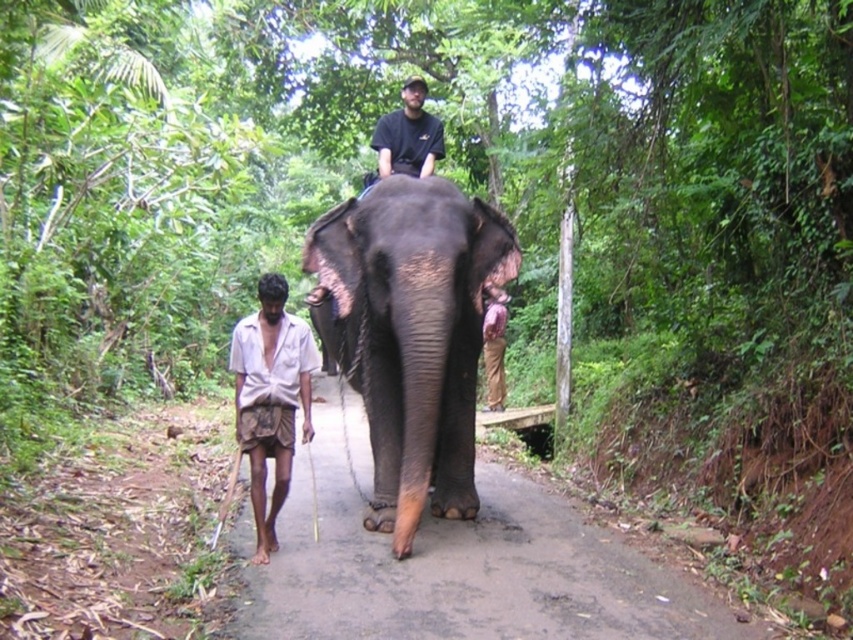
Question: Is dark gray textured elephant at center positioned at the back of white clothed man at left?

Choices:
 (A) yes
 (B) no

Answer: (A)

Question: Which object is farther from the camera taking this photo?

Choices:
 (A) white clothed man at left
 (B) dark gray textured elephant at center
 (C) black matte shirt at center
 (D) brown dirt path at center

Answer: (C)

Question: Which point appears closest to the camera in this image?

Choices:
 (A) (247, 637)
 (B) (396, 193)
 (C) (421, 106)

Answer: (A)

Question: Is brown dirt path at center positioned in front of black matte shirt at center?

Choices:
 (A) no
 (B) yes

Answer: (B)

Question: Which is nearer to the white clothed man at left?

Choices:
 (A) dark gray textured elephant at center
 (B) brown dirt path at center

Answer: (A)

Question: Considering the relative positions of brown dirt path at center and black matte shirt at center in the image provided, where is brown dirt path at center located with respect to black matte shirt at center?

Choices:
 (A) left
 (B) right

Answer: (B)